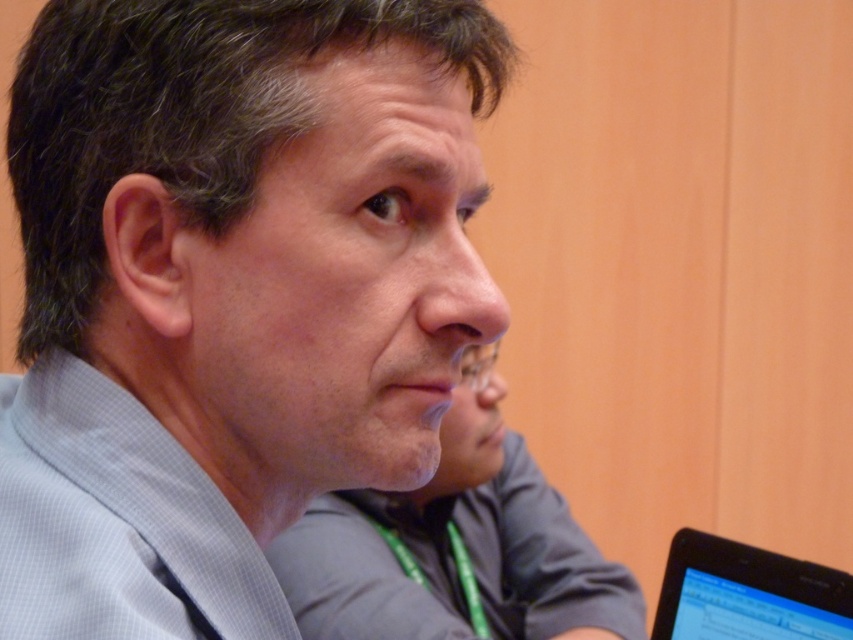
Question: Estimate the real-world distances between objects in this image. Which object is closer to the black glossy tablet at lower right?

Choices:
 (A) gray checkered shirt at center
 (B) matte gray shirt at center

Answer: (A)

Question: Which object appears closest to the camera in this image?

Choices:
 (A) light blue checkered dress shirt at center
 (B) matte gray shirt at center
 (C) gray checkered shirt at center
 (D) black glossy tablet at lower right

Answer: (A)

Question: Which is nearer to the gray checkered shirt at center?

Choices:
 (A) light blue checkered dress shirt at center
 (B) black glossy tablet at lower right

Answer: (A)

Question: Does light blue checkered dress shirt at center appear on the right side of matte gray shirt at center?

Choices:
 (A) no
 (B) yes

Answer: (A)

Question: Is gray checkered shirt at center further to the viewer compared to light blue checkered dress shirt at center?

Choices:
 (A) yes
 (B) no

Answer: (A)

Question: Does matte gray shirt at center appear under black glossy tablet at lower right?

Choices:
 (A) yes
 (B) no

Answer: (A)